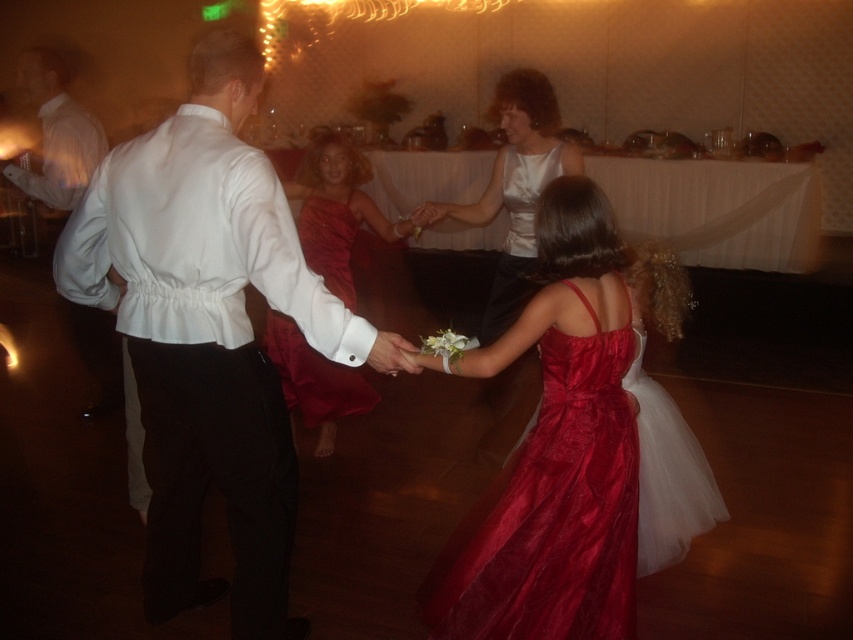
Question: Considering the real-world distances, which object is closest to the shiny satin dress at center?

Choices:
 (A) shiny satin dress at lower right
 (B) satin white dress at center
 (C) satin dress at center

Answer: (A)

Question: Does shiny satin dress at center have a larger size compared to satin dress at center?

Choices:
 (A) no
 (B) yes

Answer: (B)

Question: Can you confirm if satin white dress at center is positioned below shiny satin dress at lower right?

Choices:
 (A) yes
 (B) no

Answer: (B)

Question: Does shiny satin dress at center have a lesser width compared to shiny satin dress at lower right?

Choices:
 (A) no
 (B) yes

Answer: (A)

Question: Which object appears closest to the camera in this image?

Choices:
 (A) satin dress at center
 (B) shiny satin dress at lower right
 (C) white satin shirt at left

Answer: (C)

Question: Considering the real-world distances, which object is farthest from the shiny satin dress at lower right?

Choices:
 (A) white satin shirt at left
 (B) shiny satin dress at center

Answer: (A)